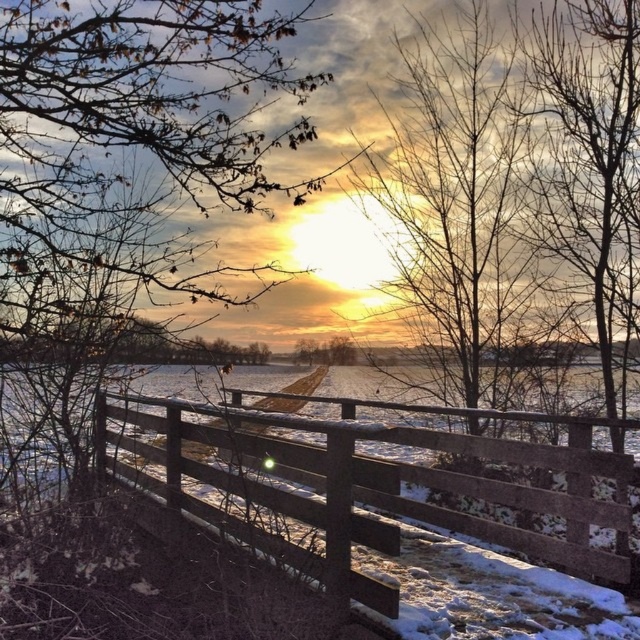
Consider the image. You are an observer standing in front of the fence. You notice two sets of branches in the scene. Which set, the brown leafy branches at upper left or the bare branches at center, is positioned higher in the image?

The brown leafy branches at upper left are positioned higher in the image than the bare branches at center.

You are an artist trying to paint the winter sunset scene. You notice the brown leafy branches at upper left and the bare branches at center. Which set of branches will appear closer to you in your painting?

The brown leafy branches at upper left appear closer because they are in front of the bare branches at center in the scene.

You are standing at the edge of the water and want to walk to the wooden fence at center. According to the coordinates provided, is the fence to your north, south, east, or west?

The wooden fence at center is located at point coordinates north of your position at the water edge.